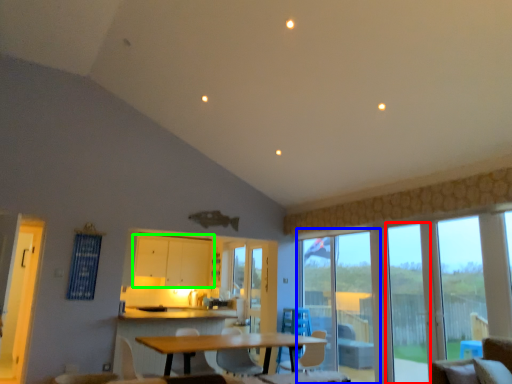
Question: Estimate the real-world distances between objects in this image. Which object is closer to window (highlighted by a red box), glass door (highlighted by a blue box) or cabinetry (highlighted by a green box)?

Choices:
 (A) glass door
 (B) cabinetry

Answer: (A)